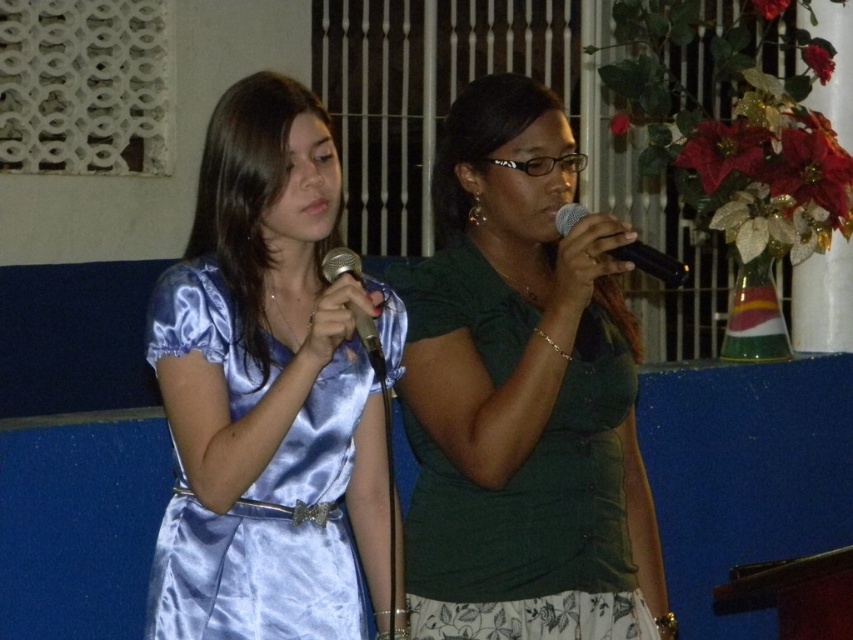
Which is more to the left, green matte shirt at center or matte black microphone at center?

matte black microphone at center

Does point (444, 264) come farther from viewer compared to point (338, 268)?

That is True.

Where is `green matte shirt at center`? This screenshot has width=853, height=640. green matte shirt at center is located at coordinates (521, 396).

Can you confirm if satin blue dress at center is positioned below matte black microphone at center?

Indeed, satin blue dress at center is positioned under matte black microphone at center.

Which is in front, point (181, 529) or point (375, 349)?

Point (375, 349) is more forward.

Does point (149, 595) come behind point (355, 326)?

Yes, point (149, 595) is farther from viewer.

Identify the location of satin blue dress at center. This screenshot has height=640, width=853. (273, 532).

Does satin blue dress at center have a larger size compared to black matte microphone at center?

Yes.

Between point (219, 323) and point (666, 257), which one is positioned in front?

Positioned in front is point (666, 257).

Which is in front, point (231, 616) or point (573, 221)?

Point (231, 616) is in front.

Image resolution: width=853 pixels, height=640 pixels. Find the location of `satin blue dress at center`. satin blue dress at center is located at coordinates (273, 532).